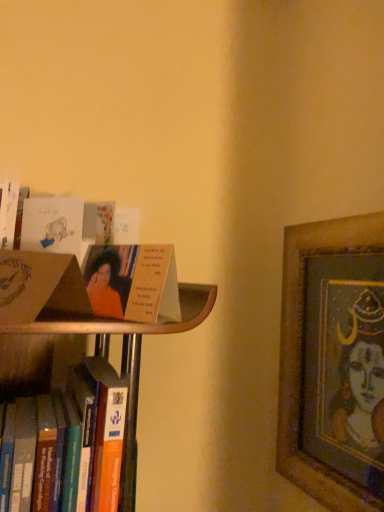
Question: Does matte white card at upper left, the first paperback book in the top-to-bottom sequence, touch wooden framed artwork at right?

Choices:
 (A) yes
 (B) no

Answer: (B)

Question: Does matte white card at upper left, which is counted as the second paperback book, starting from the bottom, lie behind wooden framed artwork at right?

Choices:
 (A) yes
 (B) no

Answer: (B)

Question: From the image's perspective, is matte white card at upper left, the second paperback book in the front-to-back sequence, below wooden framed artwork at right?

Choices:
 (A) no
 (B) yes

Answer: (A)

Question: Would you say matte white card at upper left, the first paperback book when ordered from back to front, is outside wooden framed artwork at right?

Choices:
 (A) no
 (B) yes

Answer: (B)

Question: Is matte white card at upper left, the first paperback book when ordered from back to front, far away from wooden framed artwork at right?

Choices:
 (A) yes
 (B) no

Answer: (B)

Question: Which is correct: matte cardboard book at left, which is the first paperback book from bottom to top, is inside matte white card at upper left, the first paperback book in the top-to-bottom sequence, or outside of it?

Choices:
 (A) inside
 (B) outside

Answer: (B)

Question: In the image, is matte cardboard book at left, which is the 1th paperback book in front-to-back order, on the left side or the right side of matte white card at upper left, the first paperback book in the top-to-bottom sequence?

Choices:
 (A) left
 (B) right

Answer: (A)

Question: Considering the positions of point (54, 306) and point (34, 220), is point (54, 306) closer or farther from the camera than point (34, 220)?

Choices:
 (A) closer
 (B) farther

Answer: (A)

Question: From a real-world perspective, relative to matte white card at upper left, which is counted as the second paperback book, starting from the bottom, is matte cardboard book at left, which is the second paperback book from back to front, vertically above or below?

Choices:
 (A) above
 (B) below

Answer: (B)

Question: Is wooden framed artwork at right wider or thinner than matte cardboard book at upper left?

Choices:
 (A) thin
 (B) wide

Answer: (B)

Question: Does point (319, 308) appear closer or farther from the camera than point (117, 315)?

Choices:
 (A) farther
 (B) closer

Answer: (A)

Question: Is wooden framed artwork at right bigger or smaller than matte cardboard book at upper left?

Choices:
 (A) small
 (B) big

Answer: (B)

Question: Relative to matte cardboard book at upper left, is wooden framed artwork at right in front or behind?

Choices:
 (A) behind
 (B) front

Answer: (A)

Question: Choose the correct answer: Is matte cardboard book at upper left inside matte cardboard book at left, the 2th paperback book from the top, or outside it?

Choices:
 (A) outside
 (B) inside

Answer: (A)

Question: From their relative heights in the image, would you say matte cardboard book at upper left is taller or shorter than matte cardboard book at left, the 2th paperback book from the top?

Choices:
 (A) tall
 (B) short

Answer: (A)